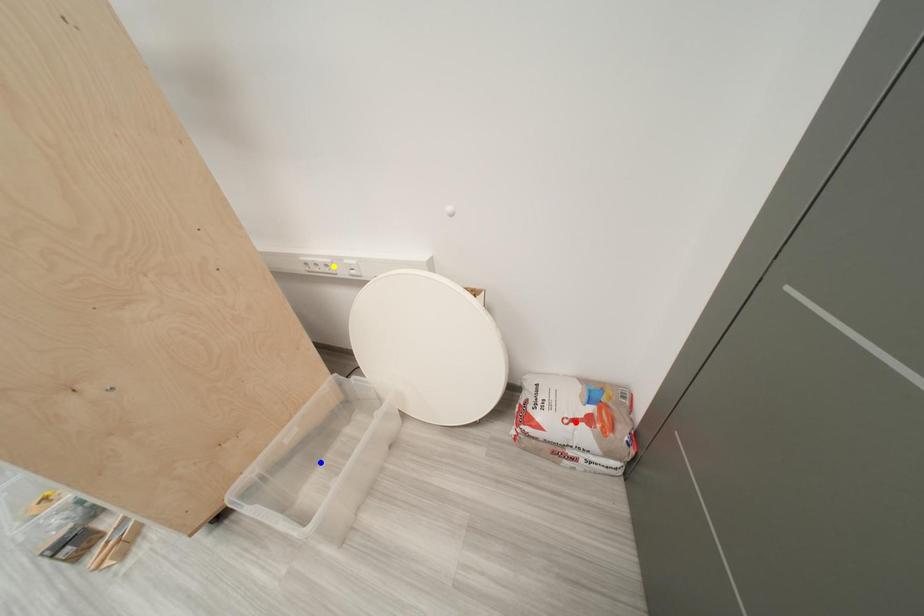
Order these from nearest to farthest:
blue point
red point
yellow point

blue point → red point → yellow point